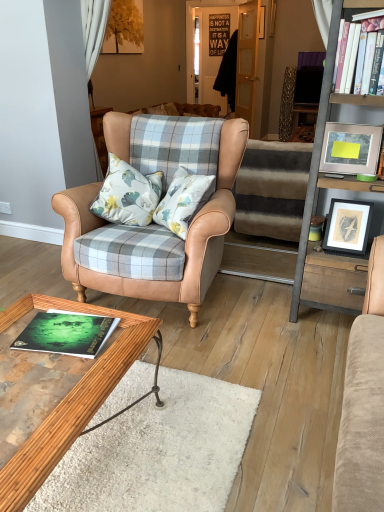
Question: From a real-world perspective, is matte white picture frame at upper right, which is the second picture frame from bottom to top, physically located above or below white hardcover book at upper right, which is the 1th book from top to bottom?

Choices:
 (A) above
 (B) below

Answer: (B)

Question: Considering the positions of matte white picture frame at upper right, placed as the 1th picture frame when sorted from top to bottom, and white hardcover book at upper right, acting as the first book starting from the back, in the image, is matte white picture frame at upper right, placed as the 1th picture frame when sorted from top to bottom, wider or thinner than white hardcover book at upper right, acting as the first book starting from the back,?

Choices:
 (A) wide
 (B) thin

Answer: (B)

Question: Which is nearer to the wooden polished coffee table at lower left?

Choices:
 (A) matte white picture frame at upper right, which is the second picture frame from bottom to top
 (B) metallic gray ladder at right
 (C) green matte book at lower left, marked as the 1th book in a left-to-right arrangement
 (D) wooden framed print at right, the 1th picture frame ordered from the bottom
 (E) leather armchair at center

Answer: (C)

Question: Based on their relative distances, which object is farther from the striped carpet at center?

Choices:
 (A) leather armchair at center
 (B) green matte book at lower left, the second book when ordered from top to bottom
 (C) wooden framed print at right, the 1th picture frame ordered from the bottom
 (D) matte white picture frame at upper right, placed as the 1th picture frame when sorted from top to bottom
 (E) metallic gray ladder at right

Answer: (B)